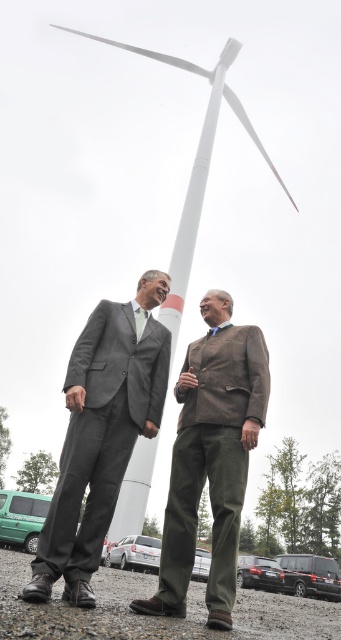
You are a photographer trying to capture a group photo of the gray suit at center and the brown textured blazer at center. Which person should you position closer to the camera to ensure both appear equally tall in the photo?

You should position the gray suit at center closer to the camera because it has a lesser height compared to the brown textured blazer at center, so moving it forward will make them appear similar in height in the photo.

You are a photographer trying to capture both the gray suit at center and the brown textured blazer at center in a single frame. Given their sizes, which one might you need to position closer to the camera to ensure both fit well in the photo?

The gray suit at center occupies less space than the brown textured blazer at center, so you should position the gray suit at center closer to the camera to balance their sizes in the frame.